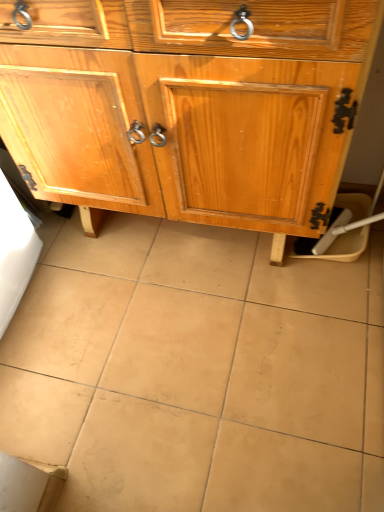
Identify the location of free space in front of wooden cabinet at center. (201, 366).